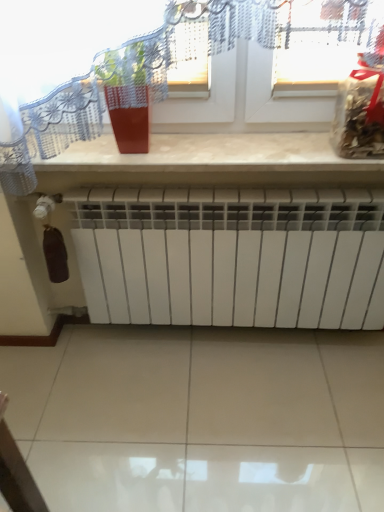
Locate an element on the screen. vacant area situated to the left side of matte red pot at upper center is located at coordinates (89, 154).